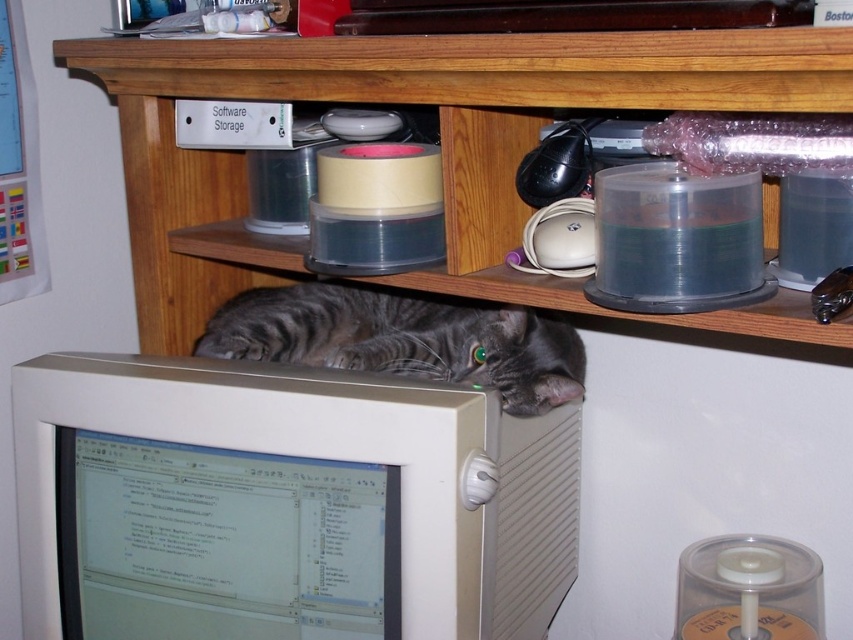
Question: Is beige plastic monitor at center to the right of wooden shelf at center from the viewer's perspective?

Choices:
 (A) yes
 (B) no

Answer: (B)

Question: Can you confirm if wooden shelf at center is positioned above gray striped fur at center?

Choices:
 (A) yes
 (B) no

Answer: (A)

Question: Among these objects, which one is farthest from the camera?

Choices:
 (A) beige plastic monitor at center
 (B) gray striped fur at center
 (C) wooden shelf at center

Answer: (B)

Question: Which object is positioned closest to the gray striped fur at center?

Choices:
 (A) wooden shelf at center
 (B) beige plastic monitor at center

Answer: (A)

Question: Where is beige plastic monitor at center located in relation to gray striped fur at center in the image?

Choices:
 (A) right
 (B) left

Answer: (B)

Question: Which point is farther to the camera?

Choices:
 (A) wooden shelf at center
 (B) beige plastic monitor at center

Answer: (B)